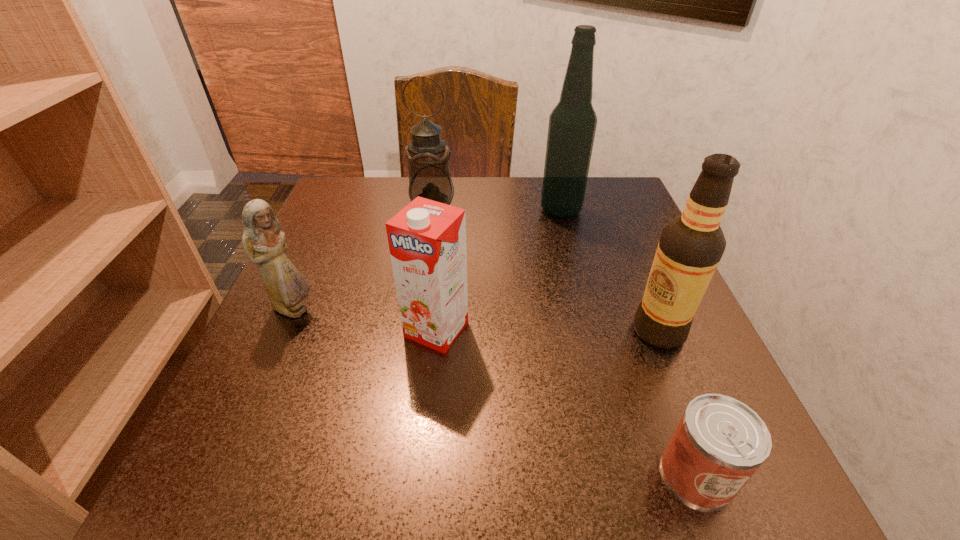
Identify the location of free space that satisfies the following two spatial constraints: 1. on the front-facing side of the can; 2. on the right side of the leftmost object. This screenshot has height=540, width=960. (221, 474).